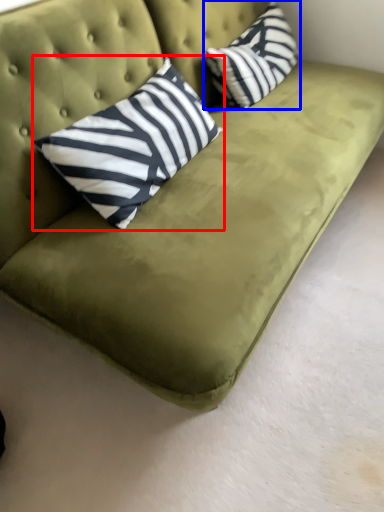
Question: Among these objects, which one is farthest to the camera, pillow (highlighted by a red box) or pillow (highlighted by a blue box)?

Choices:
 (A) pillow
 (B) pillow

Answer: (B)